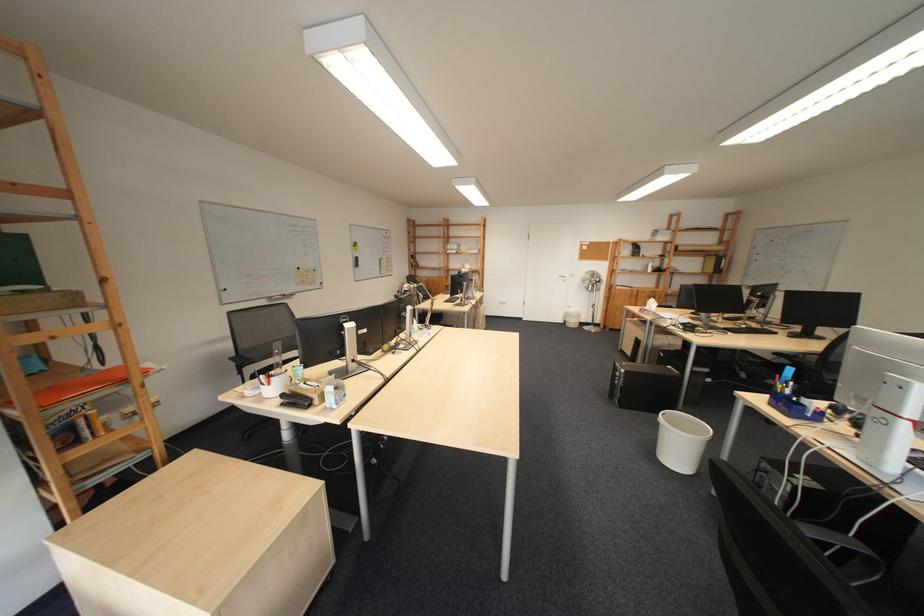
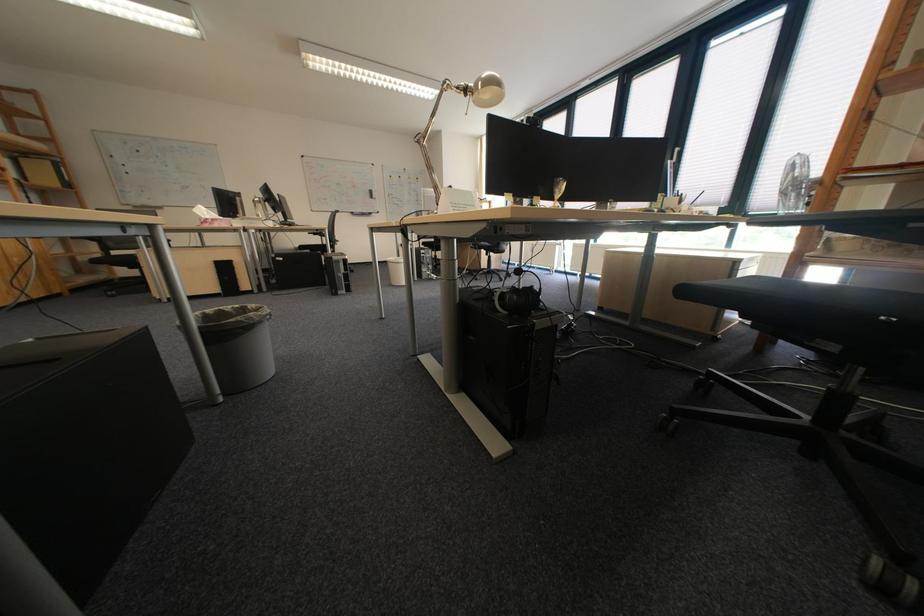
Find the pixel in the second image that matches point (657, 313) in the first image.

(225, 225)